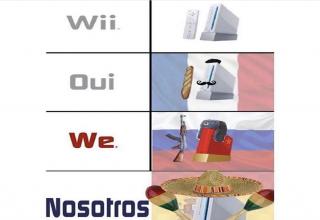
This screenshot has width=320, height=220. Find the location of `game console`. game console is located at coordinates (213, 24).